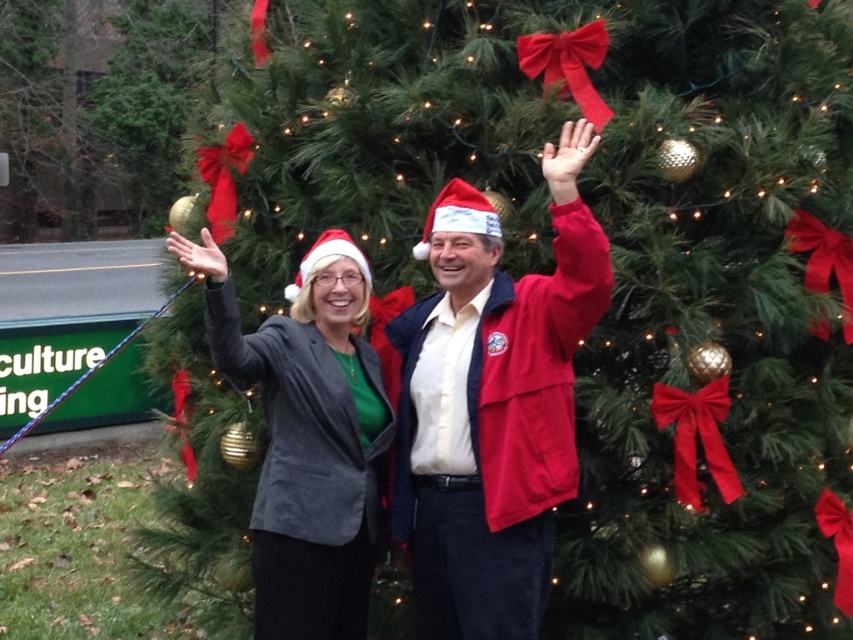
Question: Does matte black blazer at center have a smaller size compared to matte gray blazer at center?

Choices:
 (A) yes
 (B) no

Answer: (A)

Question: Which object is positioned closest to the shiny gold ornament at left?

Choices:
 (A) matte black blazer at center
 (B) matte gray blazer at center

Answer: (B)

Question: Is matte black blazer at center below matte gray blazer at center?

Choices:
 (A) yes
 (B) no

Answer: (B)

Question: Can you confirm if matte gray blazer at center is positioned to the left of shiny gold ornament at left?

Choices:
 (A) no
 (B) yes

Answer: (A)

Question: Which of the following is the farthest from the observer?

Choices:
 (A) (405, 337)
 (B) (103, 68)

Answer: (B)

Question: Which object is closer to the camera taking this photo?

Choices:
 (A) matte black blazer at center
 (B) shiny gold ornament at left
 (C) matte gray blazer at center

Answer: (A)